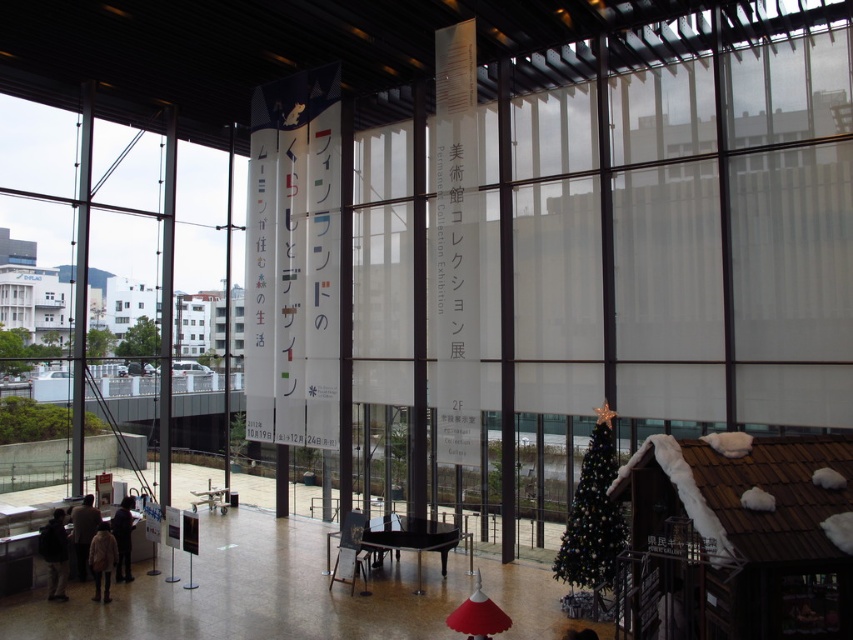
Locate an element on the screen. The width and height of the screenshot is (853, 640). green matte christmas tree at lower right is located at coordinates (593, 515).

Which of these two, green matte christmas tree at lower right or dark gray sweater at lower left, stands taller?

green matte christmas tree at lower right is taller.

Is point (561, 570) positioned before point (119, 532)?

Yes, point (561, 570) is in front of point (119, 532).

Where is `green matte christmas tree at lower right`? Image resolution: width=853 pixels, height=640 pixels. green matte christmas tree at lower right is located at coordinates (593, 515).

Does point (569, 561) come in front of point (77, 552)?

That is True.

Between green matte christmas tree at lower right and dark brown leather jacket at lower left, which one has less height?

With less height is dark brown leather jacket at lower left.

Is point (595, 522) behind point (80, 545)?

No, it is not.

Locate an element on the screen. The height and width of the screenshot is (640, 853). green matte christmas tree at lower right is located at coordinates (593, 515).

Who is positioned more to the right, dark gray backpack at lower left or dark gray sweater at lower left?

Positioned to the right is dark gray sweater at lower left.

Is dark gray backpack at lower left positioned behind dark gray sweater at lower left?

No, dark gray backpack at lower left is in front of dark gray sweater at lower left.

You are a GUI agent. You are given a task and a screenshot of the screen. Output one action in this format:
    pyautogui.click(x=<x>, y=<y>)
    Task: Click on the dark gray backpack at lower left
    This screenshot has height=640, width=853.
    Given the screenshot: What is the action you would take?
    pyautogui.click(x=55, y=554)